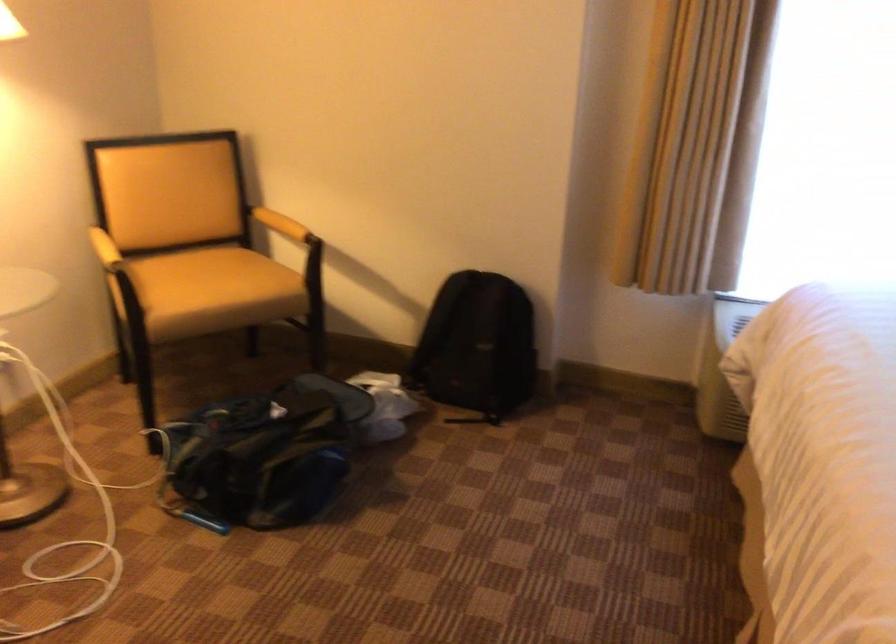
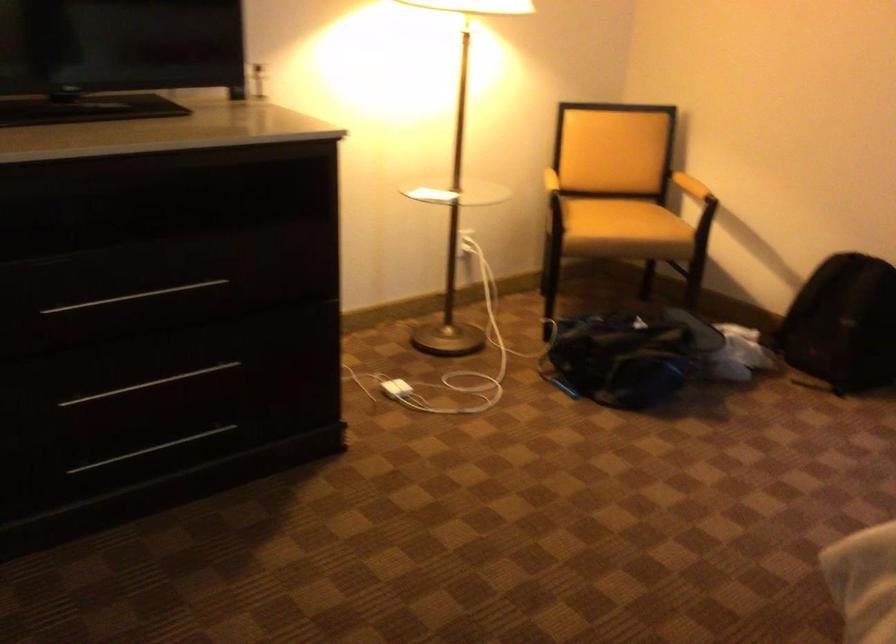
The point at [228,283] is marked in the first image. Where is the corresponding point in the second image?

(623, 220)